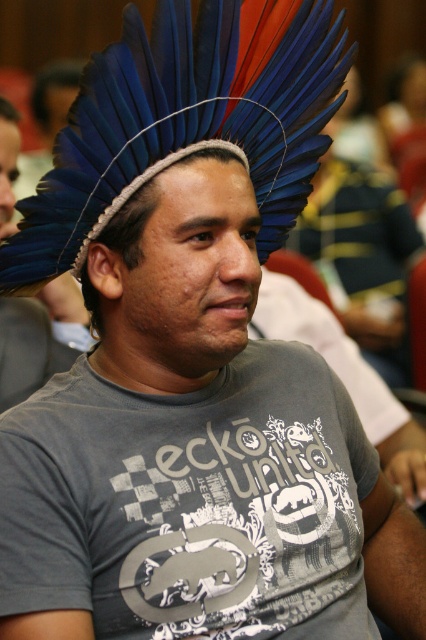
Who is higher up, gray printed t-shirt at center or blue feathered headdress at upper center?

blue feathered headdress at upper center is higher up.

Is gray printed t-shirt at center below blue feathered headdress at upper center?

Yes.

Between point (158, 420) and point (6, 120), which one is positioned in front?

Point (158, 420) is more forward.

This screenshot has width=426, height=640. In order to click on gray printed t-shirt at center in this screenshot , I will do `click(190, 502)`.

Is point (3, 138) in front of point (8, 216)?

No, it is not.

Can you confirm if blue feather headdress at upper center is shorter than blue feathered headdress at upper center?

Incorrect, blue feather headdress at upper center's height does not fall short of blue feathered headdress at upper center's.

Locate an element on the screen. blue feather headdress at upper center is located at coordinates pyautogui.click(x=37, y=339).

Does gray printed t-shirt at center appear on the left side of blue feather headdress at upper center?

No, gray printed t-shirt at center is not to the left of blue feather headdress at upper center.

Is gray printed t-shirt at center to the right of blue feather headdress at upper center from the viewer's perspective?

Indeed, gray printed t-shirt at center is positioned on the right side of blue feather headdress at upper center.

The height and width of the screenshot is (640, 426). I want to click on gray printed t-shirt at center, so tap(190, 502).